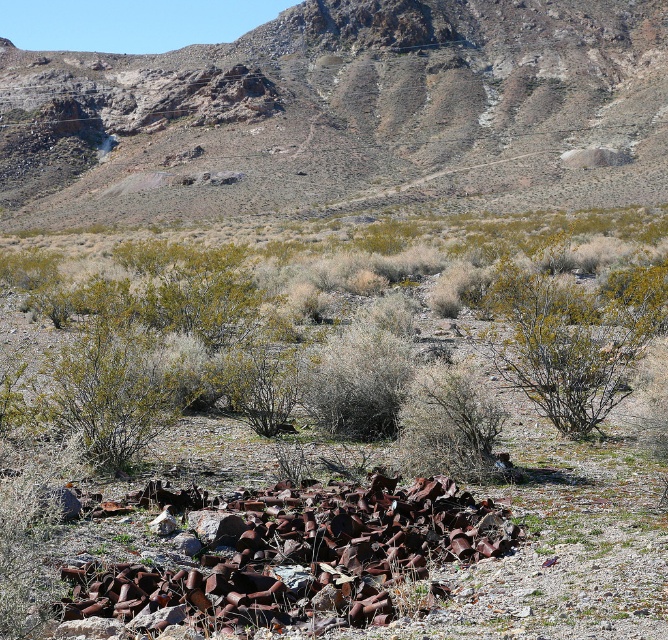
Who is positioned more to the right, rusty metal mountain at upper center or green shrubs at center?

From the viewer's perspective, rusty metal mountain at upper center appears more on the right side.

Which is behind, point (190, 124) or point (432, 326)?

The point (190, 124) is more distant.

The image size is (668, 640). I want to click on rusty metal mountain at upper center, so click(347, 113).